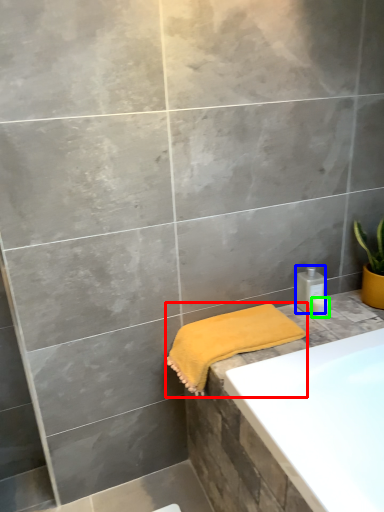
Question: Estimate the real-world distances between objects in this image. Which object is farther from towel (highlighted by a red box), toiletry (highlighted by a blue box) or toiletry (highlighted by a green box)?

Choices:
 (A) toiletry
 (B) toiletry

Answer: (B)